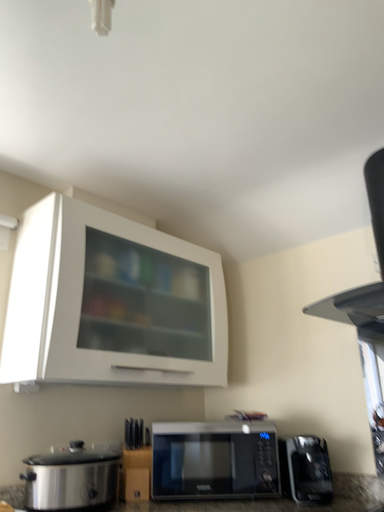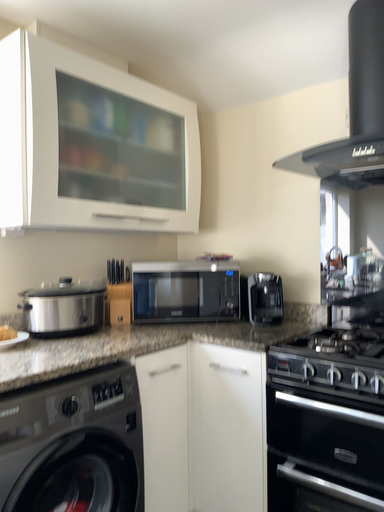
Question: How did the camera likely rotate when shooting the video?

Choices:
 (A) rotated upward
 (B) rotated downward

Answer: (B)